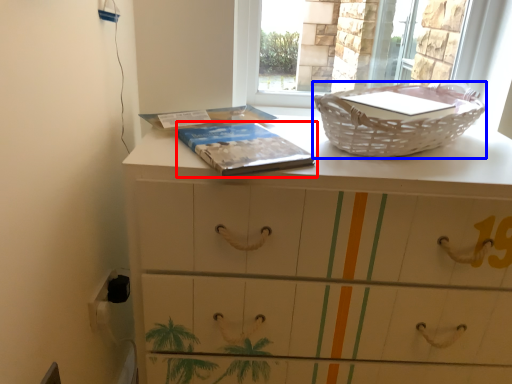
Question: Which of the following is the closest to the observer, paperback book (highlighted by a red box) or basket container (highlighted by a blue box)?

Choices:
 (A) paperback book
 (B) basket container

Answer: (A)